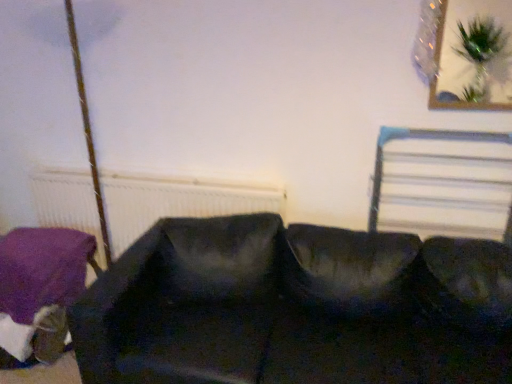
Question: Can you confirm if purple fabric cushion at lower left is taller than white textured radiator at left?

Choices:
 (A) yes
 (B) no

Answer: (B)

Question: From the image's perspective, is purple fabric cushion at lower left located beneath white textured radiator at left?

Choices:
 (A) no
 (B) yes

Answer: (B)

Question: Is purple fabric cushion at lower left surrounding white textured radiator at left?

Choices:
 (A) yes
 (B) no

Answer: (B)

Question: From a real-world perspective, is purple fabric cushion at lower left below white textured radiator at left?

Choices:
 (A) yes
 (B) no

Answer: (A)

Question: Is purple fabric cushion at lower left outside of white textured radiator at left?

Choices:
 (A) yes
 (B) no

Answer: (A)

Question: Looking at their shapes, would you say white textured radiator at left is wider or thinner than purple fabric cushion at lower left?

Choices:
 (A) wide
 (B) thin

Answer: (B)

Question: Is point (68, 198) positioned closer to the camera than point (7, 276)?

Choices:
 (A) closer
 (B) farther

Answer: (B)

Question: From a real-world perspective, is white textured radiator at left positioned above or below purple fabric cushion at lower left?

Choices:
 (A) below
 (B) above

Answer: (B)

Question: In terms of height, does white textured radiator at left look taller or shorter compared to purple fabric cushion at lower left?

Choices:
 (A) tall
 (B) short

Answer: (A)

Question: In terms of size, does metallic silver bed frame at upper right appear bigger or smaller than black fabric couch at center?

Choices:
 (A) big
 (B) small

Answer: (B)

Question: From a real-world perspective, relative to black fabric couch at center, is metallic silver bed frame at upper right vertically above or below?

Choices:
 (A) above
 (B) below

Answer: (A)

Question: Does point (389, 127) appear closer or farther from the camera than point (287, 332)?

Choices:
 (A) closer
 (B) farther

Answer: (B)

Question: Is metallic silver bed frame at upper right to the left or to the right of black fabric couch at center in the image?

Choices:
 (A) left
 (B) right

Answer: (B)

Question: In terms of width, does white textured radiator at left look wider or thinner when compared to metallic silver bed frame at upper right?

Choices:
 (A) wide
 (B) thin

Answer: (B)

Question: Considering the relative positions of white textured radiator at left and metallic silver bed frame at upper right in the image provided, is white textured radiator at left to the left or to the right of metallic silver bed frame at upper right?

Choices:
 (A) left
 (B) right

Answer: (A)